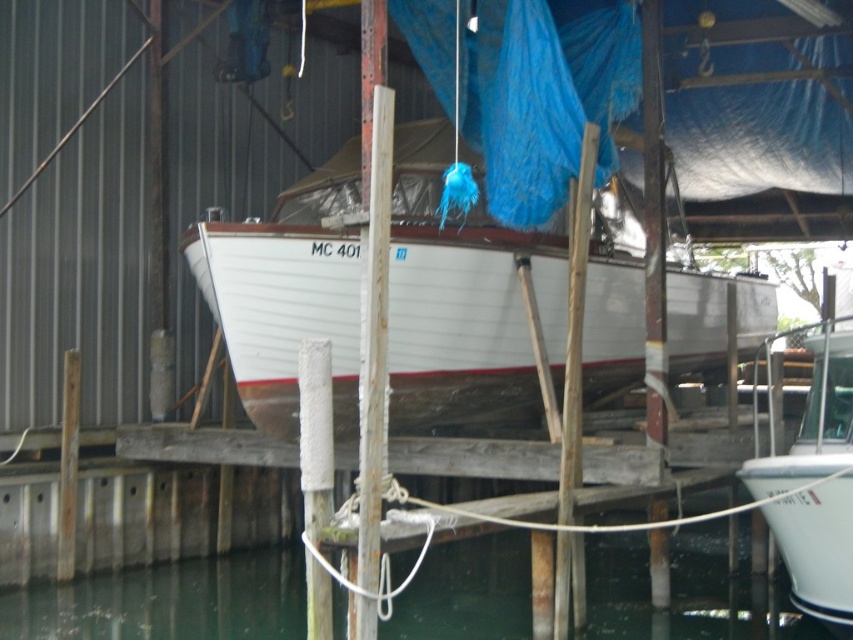
Question: Is greenish water at lower center bigger than rusty metal pole at center?

Choices:
 (A) no
 (B) yes

Answer: (A)

Question: Can you confirm if white glossy boat at lower right is bigger than rusty metal pole at center?

Choices:
 (A) yes
 (B) no

Answer: (A)

Question: Which point is closer to the camera?

Choices:
 (A) (830, 611)
 (B) (483, 573)

Answer: (A)

Question: Based on their relative distances, which object is nearer to the greenish water at lower center?

Choices:
 (A) white wood boat at center
 (B) white glossy boat at lower right
 (C) rusty metal pole at center

Answer: (C)

Question: Is white wood boat at center below rusty metal pole at center?

Choices:
 (A) yes
 (B) no

Answer: (B)

Question: Estimate the real-world distances between objects in this image. Which object is closer to the rusty metal pole at center?

Choices:
 (A) greenish water at lower center
 (B) white glossy boat at lower right
 (C) white wood boat at center

Answer: (C)